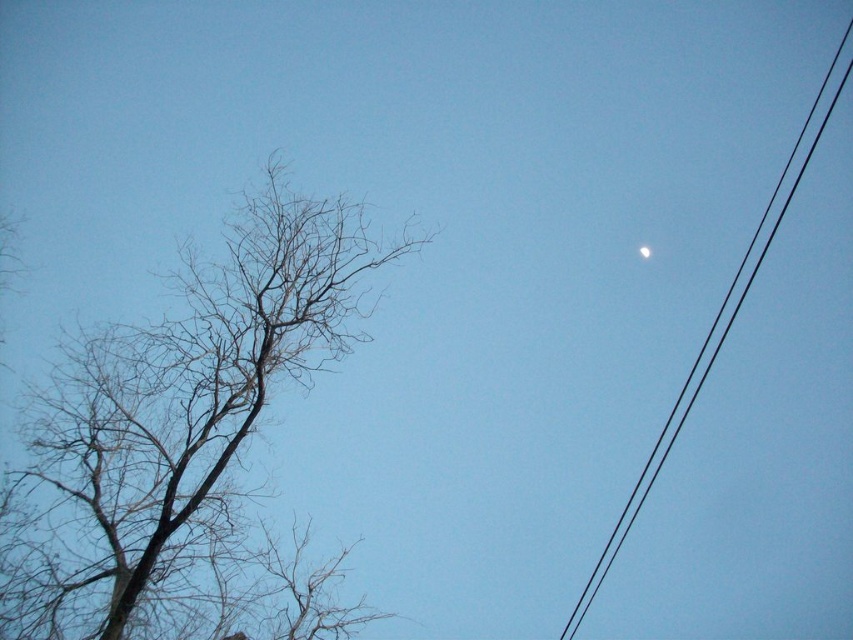
Question: Is black wire at upper right positioned behind white glossy moon at upper right?

Choices:
 (A) yes
 (B) no

Answer: (A)

Question: Does brown/dry wood tree at left appear over white glossy moon at upper right?

Choices:
 (A) no
 (B) yes

Answer: (A)

Question: Which of these objects is positioned closest to the white glossy moon at upper right?

Choices:
 (A) black wire at upper right
 (B) brown/dry wood tree at left

Answer: (A)

Question: Among these points, which one is nearest to the camera?

Choices:
 (A) (730, 300)
 (B) (172, 573)

Answer: (B)

Question: Is black wire at upper right positioned in front of white glossy moon at upper right?

Choices:
 (A) no
 (B) yes

Answer: (A)

Question: Which is nearer to the brown/dry wood tree at left?

Choices:
 (A) white glossy moon at upper right
 (B) black wire at upper right

Answer: (A)